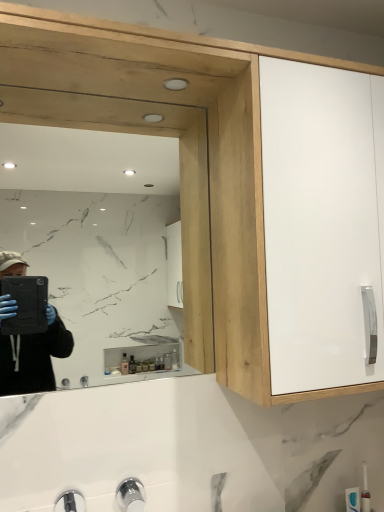
Describe the element at coordinates (322, 222) in the screenshot. This screenshot has width=384, height=512. I see `white glossy cabinet door at upper right` at that location.

You are a GUI agent. You are given a task and a screenshot of the screen. Output one action in this format:
    pyautogui.click(x=<x>, y=<y>)
    Task: Click on the white glossy cabinet door at upper right
    This screenshot has height=512, width=384.
    Given the screenshot: What is the action you would take?
    pyautogui.click(x=322, y=222)

Image resolution: width=384 pixels, height=512 pixels. Identify the location of clear glass mirror at upper left. (104, 258).

Describe the element at coordinates (104, 258) in the screenshot. I see `clear glass mirror at upper left` at that location.

You are a GUI agent. You are given a task and a screenshot of the screen. Output one action in this format:
    pyautogui.click(x=<x>, y=<y>)
    Task: Click on the white glossy cabinet door at upper right
    The image size is (384, 512).
    Given the screenshot: What is the action you would take?
    pyautogui.click(x=322, y=222)

Considering the positions of objects clear glass mirror at upper left and white glossy cabinet door at upper right in the image provided, who is more to the right, clear glass mirror at upper left or white glossy cabinet door at upper right?

From the viewer's perspective, white glossy cabinet door at upper right appears more on the right side.

Which object is further away from the camera taking this photo, clear glass mirror at upper left or white glossy cabinet door at upper right?

clear glass mirror at upper left is behind.

Does point (171, 202) appear closer or farther from the camera than point (302, 315)?

Point (171, 202) is farther from the camera than point (302, 315).

From the image's perspective, is clear glass mirror at upper left positioned above or below white glossy cabinet door at upper right?

clear glass mirror at upper left is below white glossy cabinet door at upper right.

From a real-world perspective, between clear glass mirror at upper left and white glossy cabinet door at upper right, who is vertically lower?

From a 3D spatial view, clear glass mirror at upper left is below.

Considering the relative sizes of clear glass mirror at upper left and white glossy cabinet door at upper right in the image provided, is clear glass mirror at upper left thinner than white glossy cabinet door at upper right?

Indeed, clear glass mirror at upper left has a lesser width compared to white glossy cabinet door at upper right.

Which of these two, clear glass mirror at upper left or white glossy cabinet door at upper right, stands shorter?

With less height is clear glass mirror at upper left.

Does clear glass mirror at upper left have a larger size compared to white glossy cabinet door at upper right?

Incorrect, clear glass mirror at upper left is not larger than white glossy cabinet door at upper right.

Is clear glass mirror at upper left inside or outside of white glossy cabinet door at upper right?

clear glass mirror at upper left cannot be found inside white glossy cabinet door at upper right.

Is clear glass mirror at upper left far from white glossy cabinet door at upper right?

Yes, clear glass mirror at upper left is far from white glossy cabinet door at upper right.

From the picture: Is clear glass mirror at upper left aimed at white glossy cabinet door at upper right?

No, clear glass mirror at upper left is not oriented towards white glossy cabinet door at upper right.

What's the angular difference between clear glass mirror at upper left and white glossy cabinet door at upper right's facing directions?

0.606 degrees separate the facing orientations of clear glass mirror at upper left and white glossy cabinet door at upper right.

Locate an element on the screen. glass door above the clear glass mirror at upper left (from a real-world perspective) is located at coordinates click(x=322, y=222).

Considering the relative positions of white glossy cabinet door at upper right and clear glass mirror at upper left in the image provided, is white glossy cabinet door at upper right to the right of clear glass mirror at upper left from the viewer's perspective?

Correct, you'll find white glossy cabinet door at upper right to the right of clear glass mirror at upper left.

Is white glossy cabinet door at upper right further to camera compared to clear glass mirror at upper left?

No, the depth of white glossy cabinet door at upper right is less than that of clear glass mirror at upper left.

Is point (345, 129) behind point (34, 204)?

No, it is not.

From the image's perspective, is white glossy cabinet door at upper right under clear glass mirror at upper left?

Incorrect, from the image's perspective, white glossy cabinet door at upper right is higher than clear glass mirror at upper left.

From a real-world perspective, is white glossy cabinet door at upper right beneath clear glass mirror at upper left?

Incorrect, from a real-world perspective, white glossy cabinet door at upper right is higher than clear glass mirror at upper left.

Which of these two, white glossy cabinet door at upper right or clear glass mirror at upper left, is thinner?

Thinner between the two is clear glass mirror at upper left.

Does white glossy cabinet door at upper right have a lesser height compared to clear glass mirror at upper left?

Incorrect, the height of white glossy cabinet door at upper right does not fall short of that of clear glass mirror at upper left.

Can you confirm if white glossy cabinet door at upper right is bigger than clear glass mirror at upper left?

Indeed, white glossy cabinet door at upper right has a larger size compared to clear glass mirror at upper left.

Is clear glass mirror at upper left inside white glossy cabinet door at upper right?

That's incorrect, clear glass mirror at upper left is not inside white glossy cabinet door at upper right.

Are white glossy cabinet door at upper right and clear glass mirror at upper left located far from each other?

white glossy cabinet door at upper right is positioned a significant distance from clear glass mirror at upper left.

Is white glossy cabinet door at upper right oriented away from clear glass mirror at upper left?

white glossy cabinet door at upper right does not have its back to clear glass mirror at upper left.

How much distance is there between white glossy cabinet door at upper right and clear glass mirror at upper left?

A distance of 2.03 meters exists between white glossy cabinet door at upper right and clear glass mirror at upper left.

Where is `mirror that appears behind the white glossy cabinet door at upper right`? Image resolution: width=384 pixels, height=512 pixels. mirror that appears behind the white glossy cabinet door at upper right is located at coordinates (104, 258).

You are a GUI agent. You are given a task and a screenshot of the screen. Output one action in this format:
    pyautogui.click(x=<x>, y=<y>)
    Task: Click on the glass door that appears above the clear glass mirror at upper left (from the image's perspective)
    The width and height of the screenshot is (384, 512).
    Given the screenshot: What is the action you would take?
    pyautogui.click(x=322, y=222)

The height and width of the screenshot is (512, 384). Find the location of `glass door on the right of clear glass mirror at upper left`. glass door on the right of clear glass mirror at upper left is located at coordinates (322, 222).